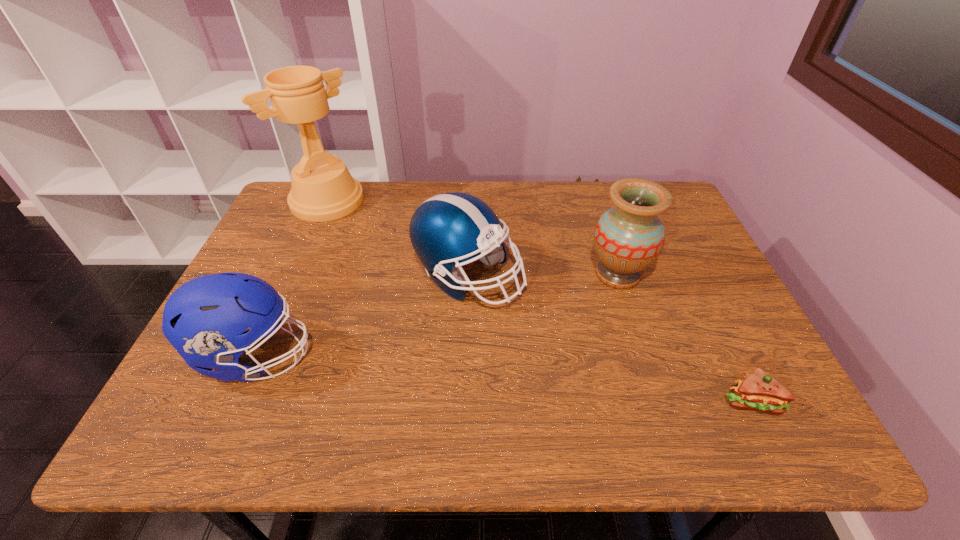
At what (x,y) coordinates should I click in order to perform the action: click on free spot between the vase and the rightmost object. Please return your answer as a coordinate pair (x, y). The width and height of the screenshot is (960, 540). Looking at the image, I should click on (684, 338).

Select which object is the fourth closest to the fourth object from left to right. Please provide its 2D coordinates. Your answer should be formatted as a tuple, i.e. [(x, y)], where the tuple contains the x and y coordinates of a point satisfying the conditions above.

[(323, 189)]

Select which object is the second closest to the third object from right to left. Please provide its 2D coordinates. Your answer should be formatted as a tuple, i.e. [(x, y)], where the tuple contains the x and y coordinates of a point satisfying the conditions above.

[(204, 319)]

Locate an element on the screen. free space that satisfies the following two spatial constraints: 1. on the front side of the second object from right to left; 2. at the front of the third object from right to left with the faceguard is located at coordinates (618, 276).